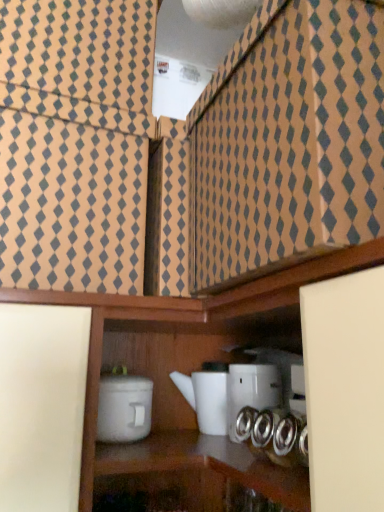
Question: Which direction should I rotate to face white glossy teapot at center, the second appliance when ordered from left to right, — up or down?

Choices:
 (A) down
 (B) up

Answer: (A)

Question: Which direction should I rotate to face white glossy teapot at center, which ranks as the 1th appliance in right-to-left order, — up or down?

Choices:
 (A) up
 (B) down

Answer: (B)

Question: Is white matte container at lower center, which is counted as the third appliance, starting from the right, oriented away from white glossy teapot at center, the second appliance when ordered from left to right?

Choices:
 (A) no
 (B) yes

Answer: (A)

Question: Does white matte container at lower center, arranged as the 1th appliance when viewed from the left, have a greater height compared to white glossy teapot at center, which is the 2th appliance from right to left?

Choices:
 (A) yes
 (B) no

Answer: (B)

Question: Is white matte container at lower center, which is counted as the third appliance, starting from the right, positioned far away from white glossy teapot at center, the second appliance when ordered from left to right?

Choices:
 (A) no
 (B) yes

Answer: (A)

Question: Is the depth of white matte container at lower center, which is counted as the third appliance, starting from the right, less than that of white glossy teapot at center, which is the 2th appliance from right to left?

Choices:
 (A) yes
 (B) no

Answer: (A)

Question: Is white matte container at lower center, which is counted as the third appliance, starting from the right, at the right side of white glossy teapot at center, the second appliance when ordered from left to right?

Choices:
 (A) no
 (B) yes

Answer: (A)

Question: Can we say white matte container at lower center, which is counted as the third appliance, starting from the right, lies outside white glossy teapot at center, which is the 2th appliance from right to left?

Choices:
 (A) yes
 (B) no

Answer: (A)

Question: From the image's perspective, is white glossy teapot at center, which ranks as the 1th appliance in right-to-left order, beneath white matte container at lower center, which is counted as the third appliance, starting from the right?

Choices:
 (A) no
 (B) yes

Answer: (A)

Question: Can you confirm if white glossy teapot at center, the 3th appliance from the left, is bigger than white matte container at lower center, which is counted as the third appliance, starting from the right?

Choices:
 (A) yes
 (B) no

Answer: (B)

Question: From a real-world perspective, is white glossy teapot at center, the 3th appliance from the left, located higher than white matte container at lower center, which is counted as the third appliance, starting from the right?

Choices:
 (A) no
 (B) yes

Answer: (B)

Question: Are white glossy teapot at center, the 3th appliance from the left, and white matte container at lower center, arranged as the 1th appliance when viewed from the left, beside each other?

Choices:
 (A) yes
 (B) no

Answer: (B)

Question: From a real-world perspective, is white glossy teapot at center, which ranks as the 1th appliance in right-to-left order, positioned under white matte container at lower center, which is counted as the third appliance, starting from the right, based on gravity?

Choices:
 (A) no
 (B) yes

Answer: (A)

Question: Does white glossy teapot at center, the 3th appliance from the left, lie in front of white matte container at lower center, arranged as the 1th appliance when viewed from the left?

Choices:
 (A) yes
 (B) no

Answer: (B)

Question: Is white glossy teapot at center, the second appliance when ordered from left to right, in contact with white matte container at lower center, arranged as the 1th appliance when viewed from the left?

Choices:
 (A) no
 (B) yes

Answer: (A)